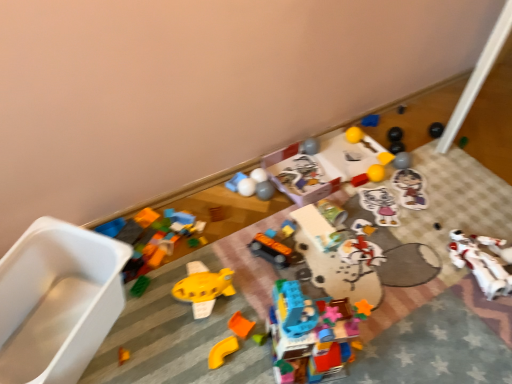
Where is `free area in between matte white plush cat at center, the thirteenth toy viewed from the left, and yellow matte toy boat at center, which ranks as the 16th toy in right-to-left order`? free area in between matte white plush cat at center, the thirteenth toy viewed from the left, and yellow matte toy boat at center, which ranks as the 16th toy in right-to-left order is located at coordinates (301, 251).